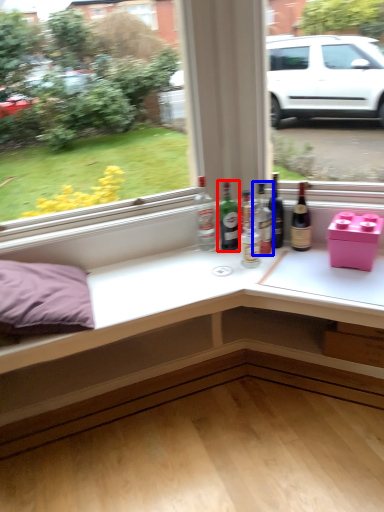
Question: Which object is further to the camera taking this photo, bottle (highlighted by a red box) or bottle (highlighted by a blue box)?

Choices:
 (A) bottle
 (B) bottle

Answer: (A)